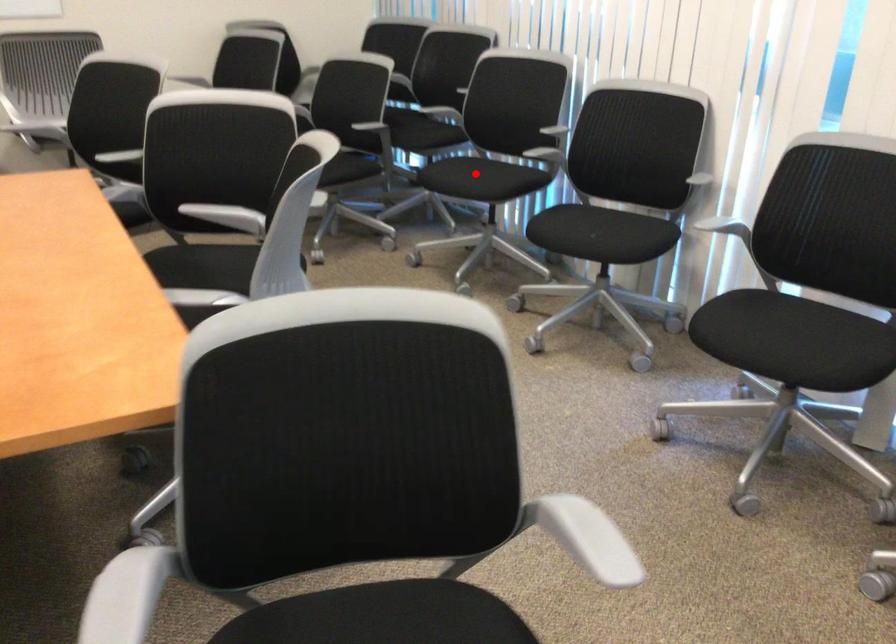
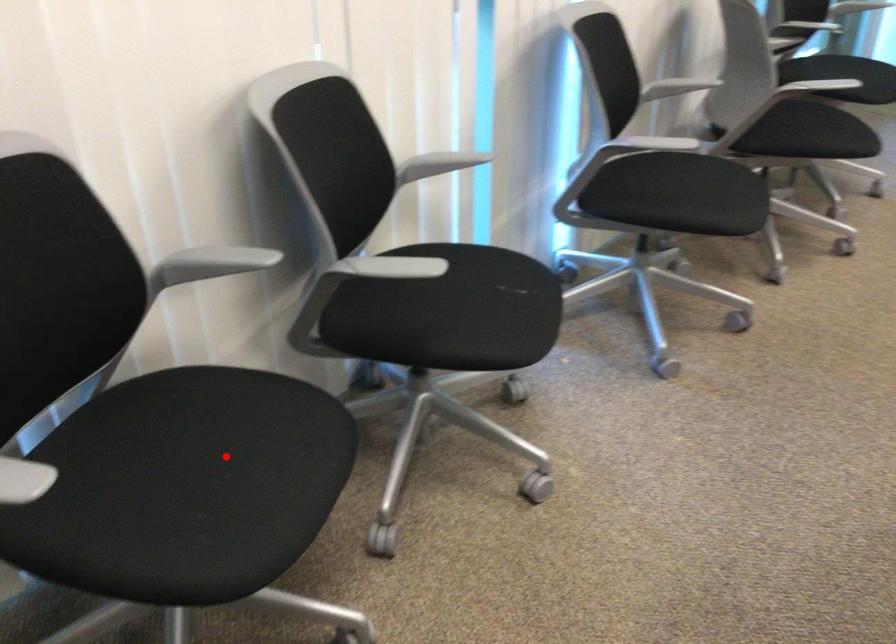
I am providing you with two images of the same scene from different viewpoints. A red point is marked on the first image and another point is marked on the second image. Does the point marked in image1 correspond to the same location as the one in image2?

Yes